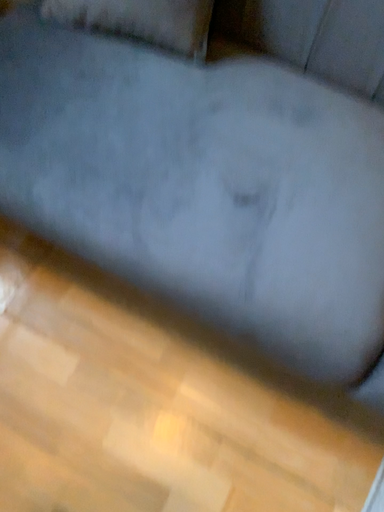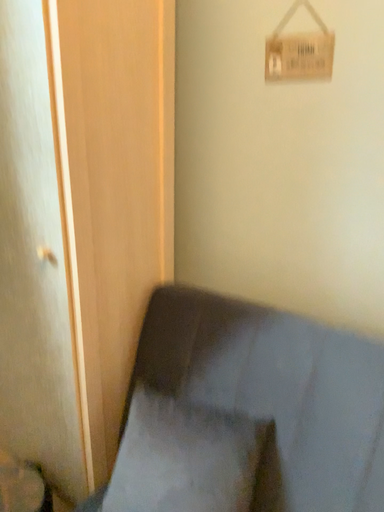
Question: Which way did the camera rotate in the video?

Choices:
 (A) rotated upward
 (B) rotated downward

Answer: (A)